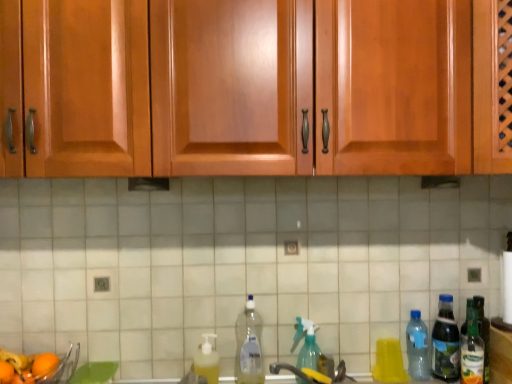
Question: From the image's perspective, is clear plastic bottle at center, the 2th bottle when ordered from left to right, positioned above or below clear plastic bottle at right, arranged as the 3th bottle when viewed from the right?

Choices:
 (A) below
 (B) above

Answer: (B)

Question: Choose the correct answer: Is clear plastic bottle at center, the 2th bottle when ordered from left to right, inside clear plastic bottle at right, arranged as the 3th bottle when viewed from the right, or outside it?

Choices:
 (A) inside
 (B) outside

Answer: (B)

Question: Which of these objects is positioned closest to the orange matte at lower left, which is counted as the 2th orange, starting from the back?

Choices:
 (A) white tile at center
 (B) green glass bottle at right, which is the 7th bottle in left-to-right order
 (C) orange matte at lower left, placed as the second orange when sorted from front to back
 (D) glossy wood cabinets at upper center
 (E) translucent plastic soap dispenser at lower center, which is counted as the seventh bottle, starting from the right

Answer: (C)

Question: Based on their relative distances, which object is nearer to the orange matte at lower left, which is counted as the 2th orange, starting from the back?

Choices:
 (A) black matte exhaust hood at center
 (B) clear plastic bottle at right, which is counted as the fifth bottle, starting from the left
 (C) yellow plastic cup at lower right, marked as the fourth bottle in a left-to-right arrangement
 (D) translucent plastic soap dispenser at lower center, the first bottle viewed from the left
 (E) clear plastic bottle at center, the sixth bottle from the right

Answer: (D)